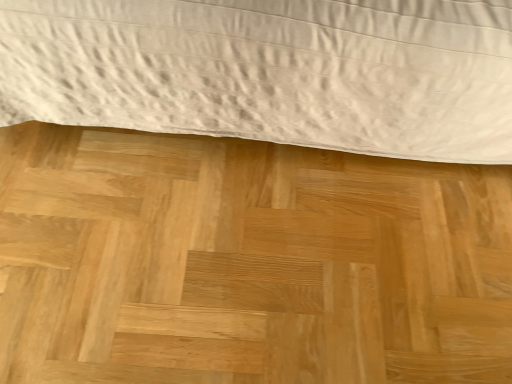
Question: Is point (320, 39) closer or farther from the camera than point (275, 375)?

Choices:
 (A) farther
 (B) closer

Answer: (B)

Question: In the image, is white textured bed at upper center on the left side or the right side of natural wood plywood at center?

Choices:
 (A) right
 (B) left

Answer: (A)

Question: From a real-world perspective, is white textured bed at upper center positioned above or below natural wood plywood at center?

Choices:
 (A) below
 (B) above

Answer: (B)

Question: Visually, is natural wood plywood at center positioned to the left or to the right of white textured bed at upper center?

Choices:
 (A) left
 (B) right

Answer: (A)

Question: From the image's perspective, is natural wood plywood at center located above or below white textured bed at upper center?

Choices:
 (A) below
 (B) above

Answer: (A)

Question: Looking at the image, does natural wood plywood at center seem bigger or smaller compared to white textured bed at upper center?

Choices:
 (A) small
 (B) big

Answer: (A)

Question: From a real-world perspective, is natural wood plywood at center positioned above or below white textured bed at upper center?

Choices:
 (A) above
 (B) below

Answer: (B)